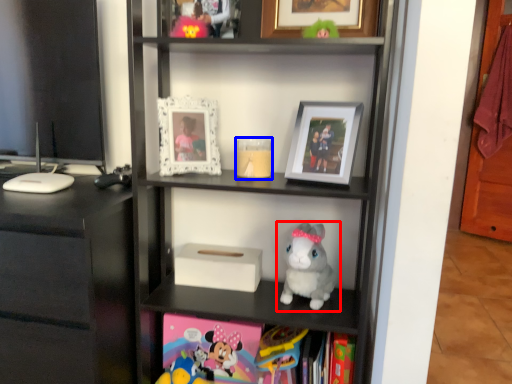
Question: Among these objects, which one is nearest to the camera, toy (highlighted by a red box) or candle holder (highlighted by a blue box)?

Choices:
 (A) toy
 (B) candle holder

Answer: (A)